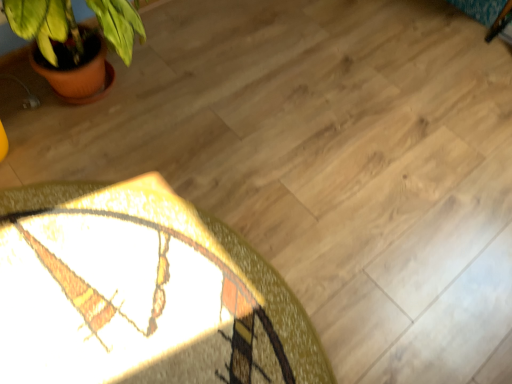
Find the location of a particular element. The image size is (512, 384). free space below shiny glass table at center (from a real-world perspective) is located at coordinates (128, 275).